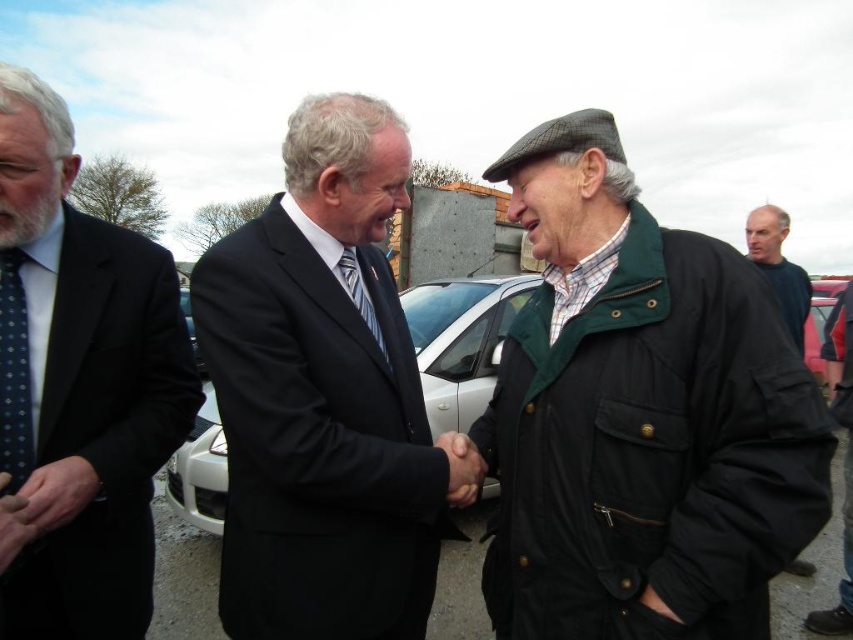
You are standing at the center of the image. Which direction should you move to get closer to the polished dark suit at left?

The polished dark suit at left is located at point 0.600 in the x coordinate, which is to the left side of the image. Since you are at the center, you should move to the left to get closer to it.

You are a photographer standing at the position of the viewer. You want to capture a photo of the polished dark suit at left without moving closer. What is the minimum focal length required to ensure the entire suit fits within the frame of a camera with a 35mm sensor? Assume the sensor has a diagonal of 43.3mm and the suit occupies 800mm in real life.

To determine the minimum focal length, use the formula focal length < sensor diagonal x object distance divided by object size. Plugging in the values, focal length < 43.3mm x 1.56m divided by 0.8m. Calculating gives approximately 83.5mm. Therefore, a focal length shorter than 83.5mm, like 50mm, would ensure the entire polished dark suit at left fits within the frame.

You are a photographer trying to capture a closeup of the polka dot silk tie at center without including the polished dark suit at left in the frame. Based on their positions, is this possible?

The polished dark suit at left is to the left of the polka dot silk tie at center, so it is possible to capture a closeup of the polka dot silk tie at center without including the polished dark suit at left by framing the shot to exclude the left side where the suit is located.